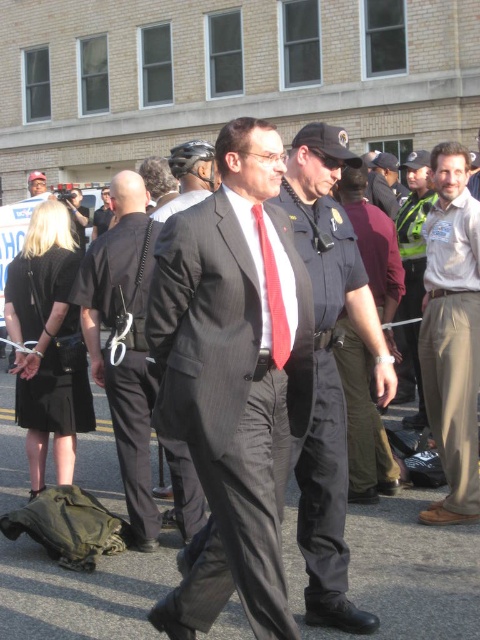
Does matte black uniform at center appear on the left side of green reflective vest at center?

Correct, you'll find matte black uniform at center to the left of green reflective vest at center.

Is point (311, 605) closer to viewer compared to point (419, 380)?

Yes.

The image size is (480, 640). Identify the location of matte black uniform at center. (328, 368).

Is point (468, 348) in front of point (377, 202)?

Yes, it is.

The image size is (480, 640). Identify the location of light brown cotton pants at center. (452, 333).

Between point (136, 266) and point (406, 252), which one is positioned behind?

Point (406, 252)

Which is more to the right, black pinstripe suit at center or green reflective vest at center?

green reflective vest at center is more to the right.

Between point (108, 259) and point (422, 400), which one is positioned in front?

Point (108, 259) is in front.

At what (x,y) coordinates should I click in order to perform the action: click on black pinstripe suit at center. Please return your answer as a coordinate pair (x, y). This screenshot has width=480, height=640. Looking at the image, I should click on (128, 342).